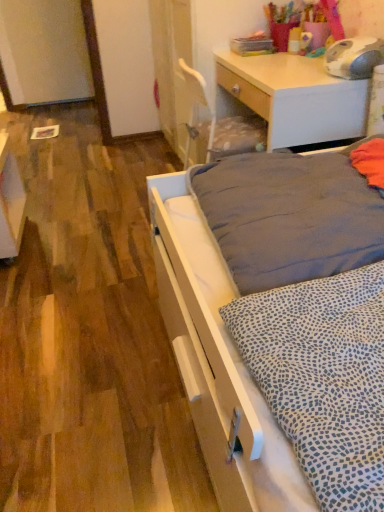
Image resolution: width=384 pixels, height=512 pixels. Identify the location of vacant space behind white glossy vanity at lower left. (50, 204).